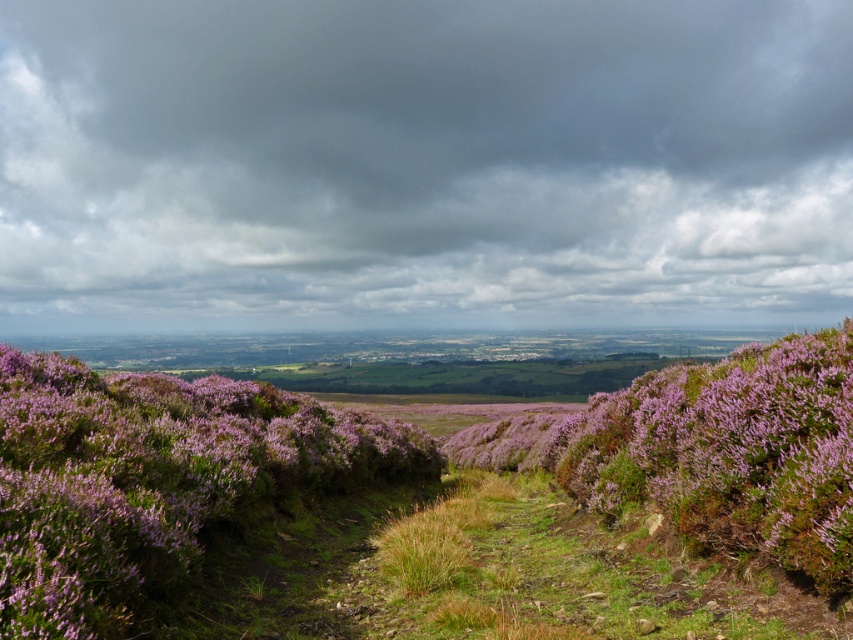
Question: Can you confirm if purple matte heather at center is wider than green grassy at center?

Choices:
 (A) yes
 (B) no

Answer: (A)

Question: Is dark gray cloud at upper center smaller than purple matte heather at center?

Choices:
 (A) yes
 (B) no

Answer: (B)

Question: Based on their relative distances, which object is nearer to the green grassy at center?

Choices:
 (A) purple matte heather at center
 (B) dark gray cloud at upper center

Answer: (A)

Question: Can you confirm if dark gray cloud at upper center is smaller than purple leafy bush at center?

Choices:
 (A) no
 (B) yes

Answer: (A)

Question: Which of the following is the closest to the observer?

Choices:
 (A) purple leafy bush at center
 (B) dark gray cloud at upper center
 (C) purple matte heather at center
 (D) green grassy at center

Answer: (C)

Question: Which object appears farthest from the camera in this image?

Choices:
 (A) dark gray cloud at upper center
 (B) purple matte heather at center
 (C) green grassy at center
 (D) purple leafy bush at center

Answer: (A)